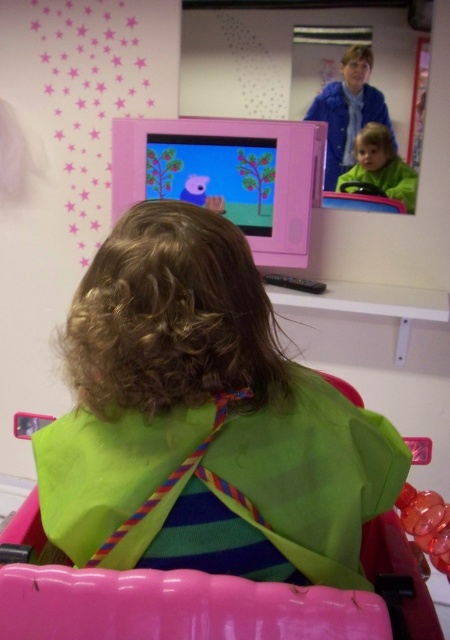
Is point (144, 417) farther from viewer compared to point (356, 173)?

That is False.

Where is `green fabric at center`? Image resolution: width=450 pixels, height=640 pixels. green fabric at center is located at coordinates (202, 420).